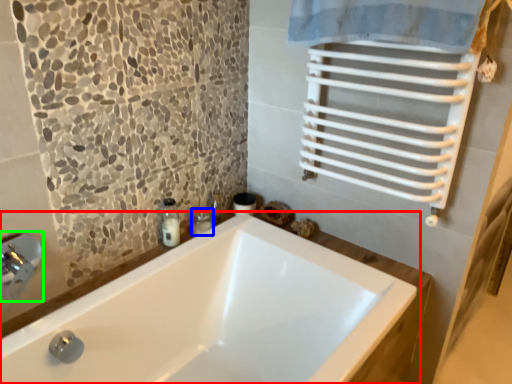
Question: Which object is positioned farthest from bathtub (highlighted by a red box)? Select from toiletry (highlighted by a blue box) and faucet (highlighted by a green box).

Choices:
 (A) toiletry
 (B) faucet

Answer: (B)